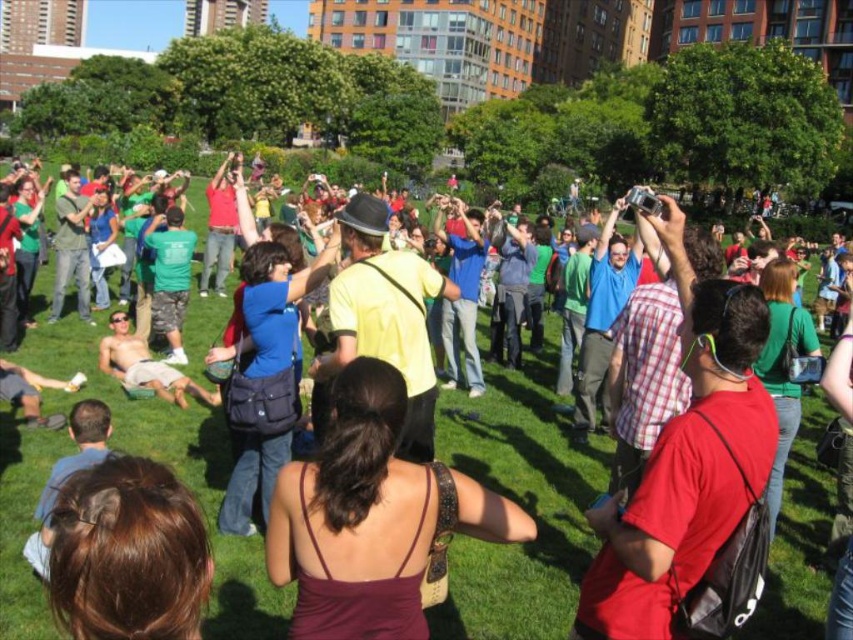
Does red matte shirt at center appear on the left side of tan skin shirtless man at center?

In fact, red matte shirt at center is to the right of tan skin shirtless man at center.

Can you confirm if red matte shirt at center is positioned below tan skin shirtless man at center?

Correct, red matte shirt at center is located below tan skin shirtless man at center.

Which is in front, point (718, 344) or point (177, 394)?

Point (718, 344) is more forward.

The height and width of the screenshot is (640, 853). I want to click on red matte shirt at center, so click(686, 474).

Based on the photo, is maroon fabric dress at center taller than red matte shirt at center?

No, maroon fabric dress at center is not taller than red matte shirt at center.

Does maroon fabric dress at center appear on the left side of red matte shirt at center?

Yes, maroon fabric dress at center is to the left of red matte shirt at center.

Is point (410, 476) positioned after point (671, 449)?

No, it is not.

Locate an element on the screen. Image resolution: width=853 pixels, height=640 pixels. maroon fabric dress at center is located at coordinates (370, 516).

Who is positioned more to the right, maroon fabric dress at center or tan skin shirtless man at center?

maroon fabric dress at center is more to the right.

Measure the distance between maroon fabric dress at center and camera.

maroon fabric dress at center is 86.03 feet from camera.

You are a GUI agent. You are given a task and a screenshot of the screen. Output one action in this format:
    pyautogui.click(x=<x>, y=<y>)
    Task: Click on the maroon fabric dress at center
    This screenshot has height=640, width=853.
    Given the screenshot: What is the action you would take?
    pyautogui.click(x=370, y=516)